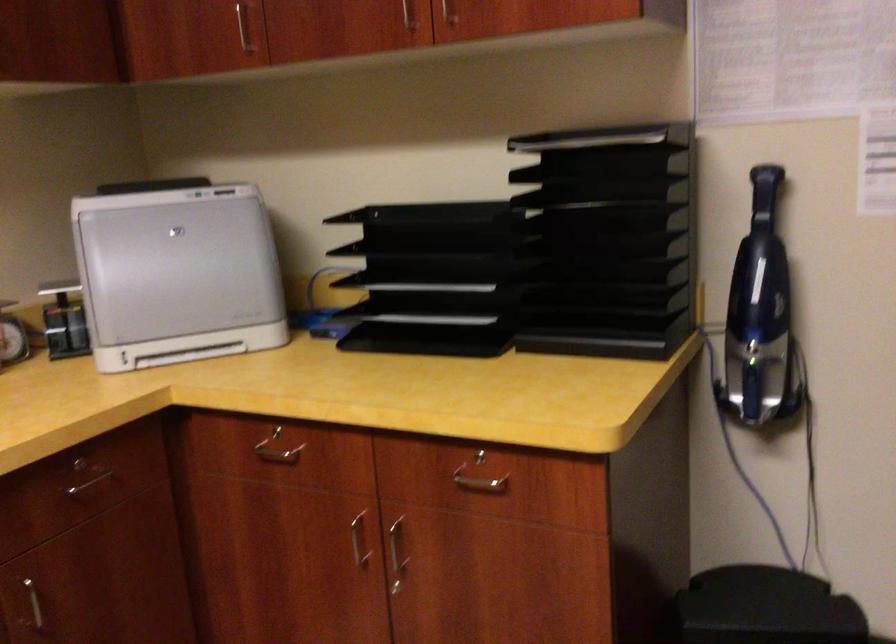
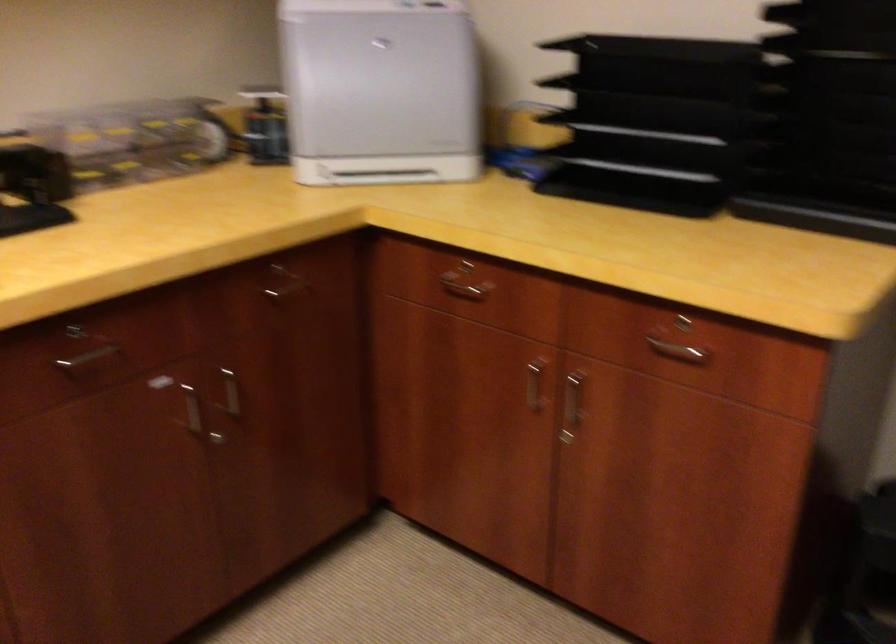
Locate, in the second image, the point that corresponds to pixel 431 339 in the first image.

(632, 190)